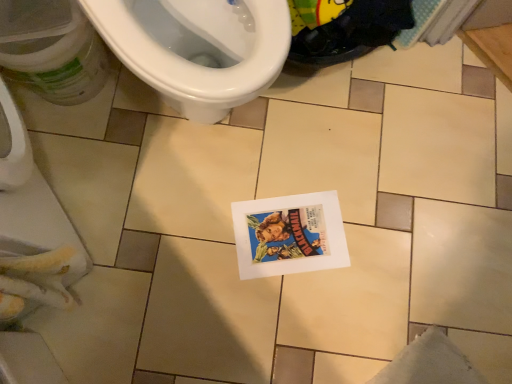
Question: Is white glossy toilet at upper left positioned with its back to white paper comic book at center?

Choices:
 (A) yes
 (B) no

Answer: (B)

Question: Is white glossy toilet at upper left surrounding white paper comic book at center?

Choices:
 (A) no
 (B) yes

Answer: (A)

Question: Can you confirm if white glossy toilet at upper left is wider than white paper comic book at center?

Choices:
 (A) no
 (B) yes

Answer: (B)

Question: Considering the relative sizes of white glossy toilet at upper left and white paper comic book at center in the image provided, is white glossy toilet at upper left thinner than white paper comic book at center?

Choices:
 (A) no
 (B) yes

Answer: (A)

Question: From a real-world perspective, is white glossy toilet at upper left positioned over white paper comic book at center based on gravity?

Choices:
 (A) yes
 (B) no

Answer: (A)

Question: Is white glossy toilet at upper left aimed at white paper comic book at center?

Choices:
 (A) no
 (B) yes

Answer: (B)

Question: Considering the relative sizes of white glossy toilet at upper left and white glossy toilet at upper left in the image provided, is white glossy toilet at upper left smaller than white glossy toilet at upper left?

Choices:
 (A) yes
 (B) no

Answer: (A)

Question: Is white glossy toilet at upper left closer to the viewer compared to white glossy toilet at upper left?

Choices:
 (A) no
 (B) yes

Answer: (A)

Question: Considering the relative sizes of white glossy toilet at upper left and white glossy toilet at upper left in the image provided, is white glossy toilet at upper left bigger than white glossy toilet at upper left?

Choices:
 (A) yes
 (B) no

Answer: (B)

Question: Is white glossy toilet at upper left at the right side of white glossy toilet at upper left?

Choices:
 (A) no
 (B) yes

Answer: (A)

Question: From a real-world perspective, is white glossy toilet at upper left under white glossy toilet at upper left?

Choices:
 (A) yes
 (B) no

Answer: (A)

Question: Considering the relative sizes of white glossy toilet at upper left and white glossy toilet at upper left in the image provided, is white glossy toilet at upper left taller than white glossy toilet at upper left?

Choices:
 (A) yes
 (B) no

Answer: (B)

Question: Is white paper comic book at center looking in the opposite direction of white glossy toilet at upper left?

Choices:
 (A) no
 (B) yes

Answer: (A)